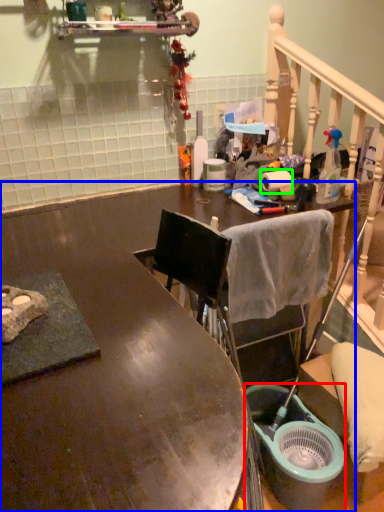
Question: Estimate the real-world distances between objects in this image. Which object is farther from bucket (highlighted by a red box), desk (highlighted by a blue box) or toilet paper (highlighted by a green box)?

Choices:
 (A) desk
 (B) toilet paper

Answer: (B)